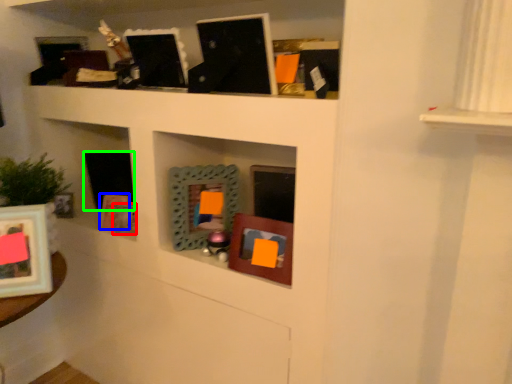
Question: Estimate the real-world distances between objects in this image. Which object is closer to picture frame (highlighted by a red box), picture frame (highlighted by a blue box) or picture frame (highlighted by a green box)?

Choices:
 (A) picture frame
 (B) picture frame

Answer: (A)